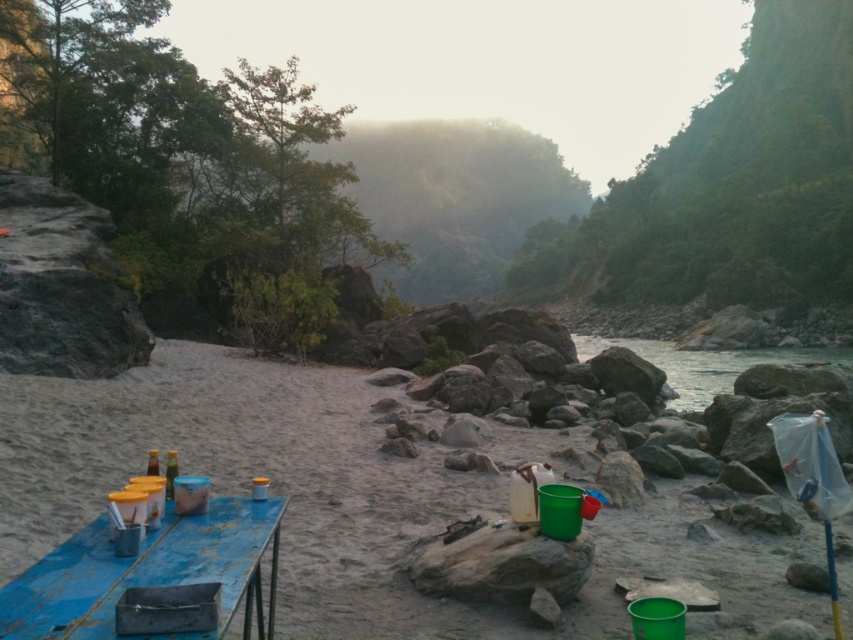
Between point (219, 506) and point (708, 360), which one is positioned behind?

The point (708, 360) is behind.

Which is in front, point (61, 580) or point (689, 364)?

Positioned in front is point (61, 580).

Does point (206, 541) come farther from viewer compared to point (804, 362)?

No, it is in front of (804, 362).

Where is `blue painted wood picnic table at lower left`? The height and width of the screenshot is (640, 853). blue painted wood picnic table at lower left is located at coordinates (148, 572).

Does point (450, 481) come closer to viewer compared to point (277, 541)?

No.

Based on the photo, does sandy beach at center appear on the left side of blue painted wood picnic table at lower left?

Incorrect, sandy beach at center is not on the left side of blue painted wood picnic table at lower left.

Does point (350, 634) come closer to viewer compared to point (141, 584)?

No, (350, 634) is behind (141, 584).

Where is `sandy beach at center`? The width and height of the screenshot is (853, 640). sandy beach at center is located at coordinates (338, 497).

Does sandy beach at center have a greater width compared to clear water at river right?

Incorrect, sandy beach at center's width does not surpass clear water at river right's.

Can you confirm if sandy beach at center is positioned to the left of clear water at river right?

Correct, you'll find sandy beach at center to the left of clear water at river right.

The height and width of the screenshot is (640, 853). What do you see at coordinates (338, 497) in the screenshot?
I see `sandy beach at center` at bounding box center [338, 497].

The width and height of the screenshot is (853, 640). What are the coordinates of `sandy beach at center` in the screenshot? It's located at (338, 497).